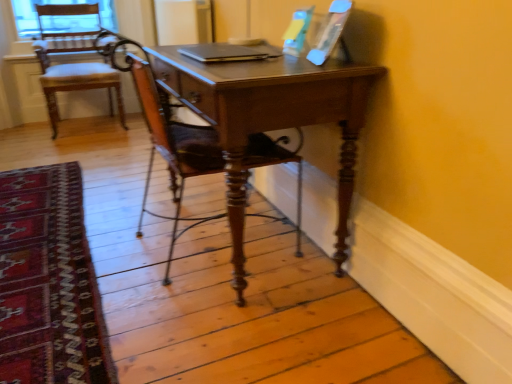
Locate an element on the screen. The height and width of the screenshot is (384, 512). free space between wooden polished chair at center, the 2th chair positioned from the left, and carpet with intricate patterns at lower left is located at coordinates (130, 220).